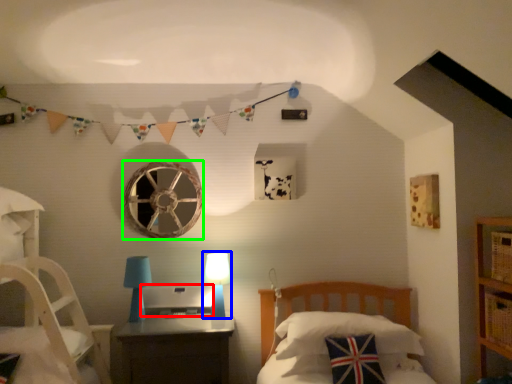
Question: Which is farther away from desktop (highlighted by a red box)? table lamp (highlighted by a blue box) or oval (highlighted by a green box)?

Choices:
 (A) table lamp
 (B) oval

Answer: (B)